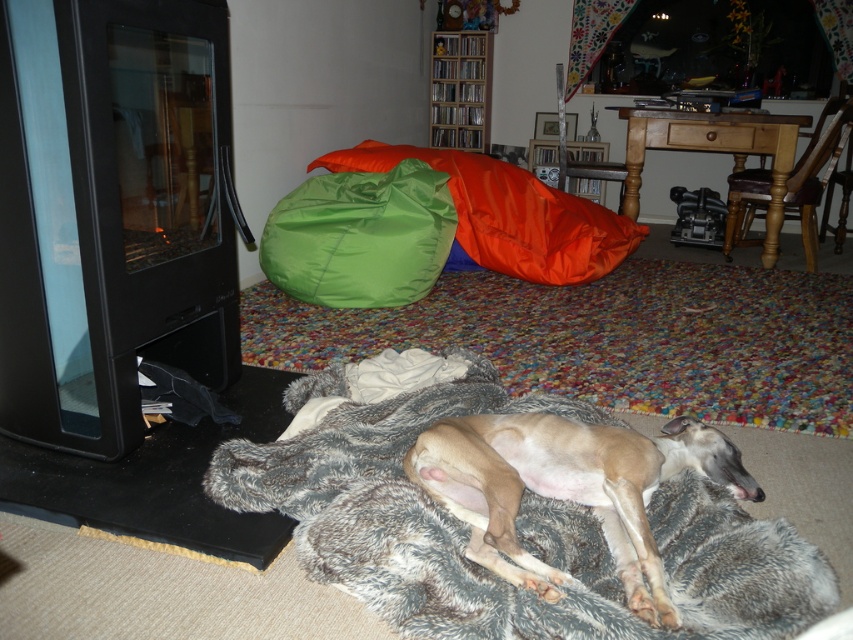
Question: Is fuzzy gray dog bed at lower center positioned in front of orange fabric bean bag at center?

Choices:
 (A) no
 (B) yes

Answer: (B)

Question: Is fuzzy gray dog bed at lower center further to camera compared to orange fabric bean bag at center?

Choices:
 (A) yes
 (B) no

Answer: (B)

Question: Which object is closer to the camera taking this photo?

Choices:
 (A) light brown fur at center
 (B) fuzzy gray dog bed at lower center
 (C) orange fabric bean bag at center

Answer: (B)

Question: Can you confirm if fuzzy gray dog bed at lower center is positioned below orange fabric bean bag at center?

Choices:
 (A) no
 (B) yes

Answer: (B)

Question: Which is nearer to the light brown fur at center?

Choices:
 (A) orange fabric bean bag at center
 (B) fuzzy gray dog bed at lower center

Answer: (B)

Question: Among these objects, which one is farthest from the camera?

Choices:
 (A) orange fabric bean bag at center
 (B) light brown fur at center
 (C) fuzzy gray dog bed at lower center

Answer: (A)